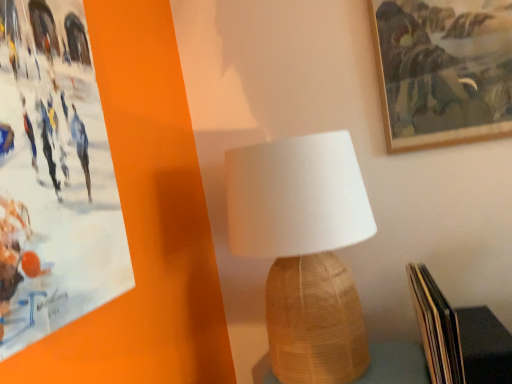
In order to face woven wood table at center, should I rotate leftwards or rightwards?

A 10.554 degree turn to the right will do.

Describe the element at coordinates (443, 71) in the screenshot. The image size is (512, 384). I see `wooden picture frame at upper right` at that location.

Where is `hardcover book at lower right`? Image resolution: width=512 pixels, height=384 pixels. hardcover book at lower right is located at coordinates (436, 327).

Image resolution: width=512 pixels, height=384 pixels. I want to click on woven wood table at center, so click(396, 364).

Is woven wood table at center directly adjacent to white woven lampshade at center?

No, woven wood table at center is not in contact with white woven lampshade at center.

Would you say white woven lampshade at center is part of woven wood table at center's contents?

That's incorrect, white woven lampshade at center is not inside woven wood table at center.

Find the location of a particular element. This screenshot has height=384, width=512. table that is on the right side of white woven lampshade at center is located at coordinates (396, 364).

How many degrees apart are the facing directions of woven wood table at center and white woven lampshade at center?

They differ by 2.64 degrees in their facing directions.

Is hardcover book at lower right positioned with its back to wooden picture frame at upper right?

That's not correct — hardcover book at lower right is not looking away from wooden picture frame at upper right.

Considering the points (430, 350) and (407, 82), which point is behind, point (430, 350) or point (407, 82)?

The point (407, 82) is more distant.

Visually, is hardcover book at lower right positioned to the left or to the right of wooden picture frame at upper right?

Based on their positions, hardcover book at lower right is located to the left of wooden picture frame at upper right.

Which of these two, white woven lampshade at center or woven wood table at center, stands shorter?

Standing shorter between the two is woven wood table at center.

Which object is thinner, white woven lampshade at center or woven wood table at center?

woven wood table at center.

From the image's perspective, between white woven lampshade at center and woven wood table at center, who is located below?

woven wood table at center appears lower in the image.

Is point (327, 176) closer or farther from the camera than point (372, 370)?

Point (327, 176) is closer to the camera than point (372, 370).

Does hardcover book at lower right have a greater height compared to white woven lampshade at center?

No.

How many degrees apart are the facing directions of hardcover book at lower right and white woven lampshade at center?

1.59 degrees.

Which point is more distant from viewer, [458,348] or [345,299]?

The point [345,299] is farther.

Is hardcover book at lower right to the left of white woven lampshade at center from the viewer's perspective?

No.

Considering the sizes of white woven lampshade at center and hardcover book at lower right in the image, is white woven lampshade at center bigger or smaller than hardcover book at lower right?

white woven lampshade at center is bigger than hardcover book at lower right.

From the image's perspective, is white woven lampshade at center beneath hardcover book at lower right?

No, from the image's perspective, white woven lampshade at center is not below hardcover book at lower right.

Is point (289, 143) less distant than point (446, 326)?

No, (289, 143) is behind (446, 326).

From the picture: Is white woven lampshade at center placed right next to hardcover book at lower right?

No, white woven lampshade at center is not beside hardcover book at lower right.

Which object is positioned more to the left, wooden picture frame at upper right or woven wood table at center?

woven wood table at center is more to the left.

Does point (436, 78) lie in front of point (411, 372)?

No, (436, 78) is behind (411, 372).

From a real-world perspective, who is located lower, wooden picture frame at upper right or woven wood table at center?

woven wood table at center, from a real-world perspective.

Between wooden picture frame at upper right and woven wood table at center, which one has smaller size?

wooden picture frame at upper right.

Which point is more distant from viewer, (399,119) or (458,374)?

The point (399,119) is behind.

Which object is more forward, wooden picture frame at upper right or hardcover book at lower right?

Positioned in front is hardcover book at lower right.

Which is more to the right, wooden picture frame at upper right or hardcover book at lower right?

Positioned to the right is wooden picture frame at upper right.

The width and height of the screenshot is (512, 384). Identify the location of table below the white woven lampshade at center (from the image's perspective). (396, 364).

You are a GUI agent. You are given a task and a screenshot of the screen. Output one action in this format:
    pyautogui.click(x=<x>, y=<y>)
    Task: Click on the paperback book on the left of wooden picture frame at upper right
    The width and height of the screenshot is (512, 384).
    Given the screenshot: What is the action you would take?
    pyautogui.click(x=436, y=327)

Estimate the real-world distances between objects in this image. Which object is closer to white woven lampshade at center, wooden picture frame at upper right or hardcover book at lower right?

The object closer to white woven lampshade at center is hardcover book at lower right.

Estimate the real-world distances between objects in this image. Which object is further from woven wood table at center, wooden picture frame at upper right or hardcover book at lower right?

The object further to woven wood table at center is wooden picture frame at upper right.

From the image, which object appears to be nearer to woven wood table at center, white woven lampshade at center or wooden picture frame at upper right?

The object closer to woven wood table at center is white woven lampshade at center.

Looking at the image, which one is located further to wooden picture frame at upper right, hardcover book at lower right or woven wood table at center?

Among the two, woven wood table at center is located further to wooden picture frame at upper right.

In the scene shown: Looking at the image, which one is located further to white woven lampshade at center, wooden picture frame at upper right or woven wood table at center?

The object further to white woven lampshade at center is wooden picture frame at upper right.

Based on their spatial positions, is woven wood table at center or hardcover book at lower right closer to white woven lampshade at center?

→ hardcover book at lower right.

From the image, which object appears to be farther from white woven lampshade at center, woven wood table at center or wooden picture frame at upper right?

wooden picture frame at upper right lies further to white woven lampshade at center than the other object.

Which object lies nearer to the anchor point hardcover book at lower right, wooden picture frame at upper right or woven wood table at center?

woven wood table at center lies closer to hardcover book at lower right than the other object.

Identify the location of paperback book between white woven lampshade at center and woven wood table at center from top to bottom. This screenshot has height=384, width=512. (436, 327).

Identify the location of lamp between wooden picture frame at upper right and woven wood table at center vertically. (304, 249).

Where is `paperback book between wooden picture frame at upper right and woven wood table at center from top to bottom`? Image resolution: width=512 pixels, height=384 pixels. paperback book between wooden picture frame at upper right and woven wood table at center from top to bottom is located at coordinates (436, 327).

Where is `lamp between wooden picture frame at upper right and hardcover book at lower right vertically`? lamp between wooden picture frame at upper right and hardcover book at lower right vertically is located at coordinates (304, 249).